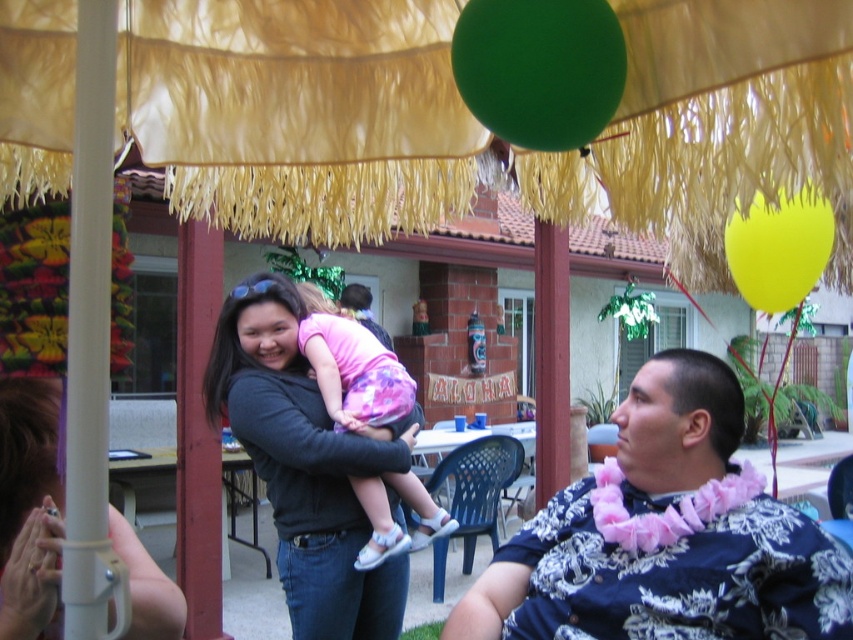
Question: In this image, where is pink fabric dress at center located relative to yellow rubber balloon at upper right?

Choices:
 (A) right
 (B) left

Answer: (B)

Question: Considering the real-world distances, which object is closest to the pink fabric dress at center?

Choices:
 (A) matte gray sweatshirt at center
 (B) green matte balloon at upper center
 (C) blue floral shirt at center

Answer: (A)

Question: Which point appears farthest from the camera in this image?

Choices:
 (A) pos(248,369)
 (B) pos(819,209)

Answer: (A)

Question: Which object appears closest to the camera in this image?

Choices:
 (A) yellow rubber balloon at upper right
 (B) matte gray sweatshirt at center
 (C) pink fabric dress at center
 (D) green matte balloon at upper center

Answer: (D)

Question: Does yellow textured fabric canopy at upper center appear under green matte balloon at upper center?

Choices:
 (A) no
 (B) yes

Answer: (B)

Question: Can you confirm if blue floral shirt at center is wider than green matte balloon at upper center?

Choices:
 (A) no
 (B) yes

Answer: (B)